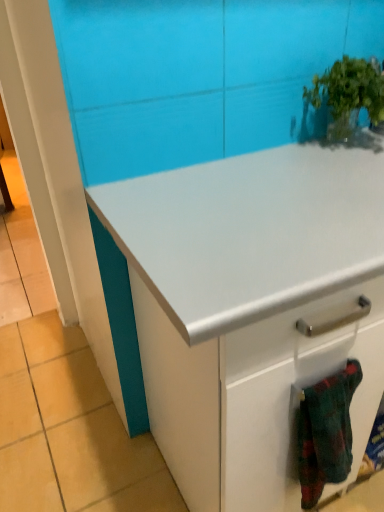
Find the location of `vacant region to the left of green leafy plant at upper right`. vacant region to the left of green leafy plant at upper right is located at coordinates (274, 165).